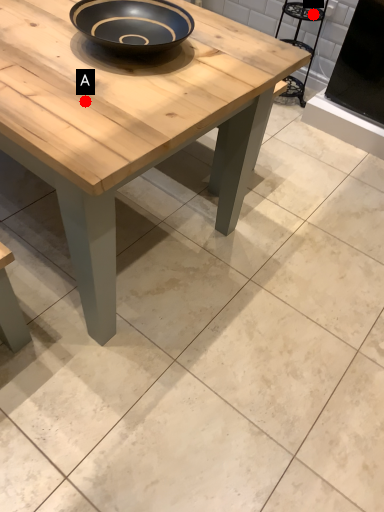
Question: Two points are circled on the image, labeled by A and B beside each circle. Which point appears closest to the camera in this image?

Choices:
 (A) A is closer
 (B) B is closer

Answer: (A)